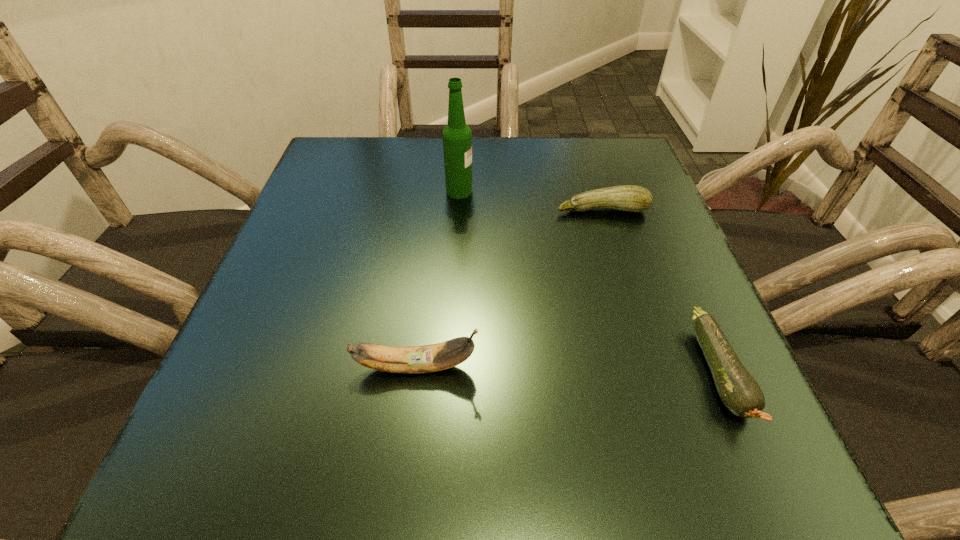
Locate an element on the screen. free spot between the nearer zucchini and the beer bottle is located at coordinates (589, 282).

Find the location of a particular element. Image resolution: width=960 pixels, height=540 pixels. vacant area that lies between the nearer zucchini and the third nearest object is located at coordinates (660, 291).

Where is `free space between the farther zucchini and the banana`? The image size is (960, 540). free space between the farther zucchini and the banana is located at coordinates (509, 288).

The height and width of the screenshot is (540, 960). Find the location of `unoccupied area between the nearer zucchini and the banana`. unoccupied area between the nearer zucchini and the banana is located at coordinates (567, 370).

Find the location of a particular element. empty space between the nearer zucchini and the third nearest object is located at coordinates (660, 291).

Where is `vacant area that lies between the second tallest object and the farthest object`? vacant area that lies between the second tallest object and the farthest object is located at coordinates (438, 279).

Identify the location of free space between the beer bottle and the farther zucchini. (531, 200).

Identify the location of free spot between the banana and the farthest object. (438, 279).

The image size is (960, 540). I want to click on vacant area that lies between the farthest object and the third nearest object, so click(531, 200).

Locate which object is the second closest to the beer bottle. Please provide its 2D coordinates. Your answer should be formatted as a tuple, i.e. [(x, y)], where the tuple contains the x and y coordinates of a point satisfying the conditions above.

[(429, 358)]